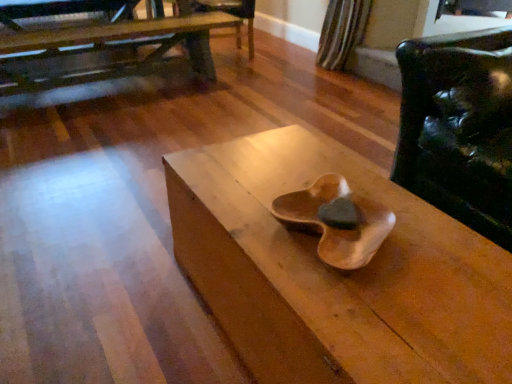
Question: Is wooden table at center, which ranks as the 2th table in back-to-front order, oriented away from wooden table at upper left, positioned as the second table in front-to-back order?

Choices:
 (A) yes
 (B) no

Answer: (B)

Question: Is wooden table at center, which is the 1th table from front to back, facing towards wooden table at upper left, positioned as the second table in front-to-back order?

Choices:
 (A) yes
 (B) no

Answer: (B)

Question: Does wooden table at center, which ranks as the 2th table in back-to-front order, lie behind wooden table at upper left, which ranks as the first table in top-to-bottom order?

Choices:
 (A) no
 (B) yes

Answer: (A)

Question: Is wooden table at center, positioned as the 2th table in left-to-right order, thinner than wooden table at upper left, arranged as the 1th table when viewed from the left?

Choices:
 (A) no
 (B) yes

Answer: (B)

Question: Can you confirm if wooden table at center, positioned as the 2th table in left-to-right order, is positioned to the right of wooden table at upper left, which ranks as the first table in top-to-bottom order?

Choices:
 (A) no
 (B) yes

Answer: (B)

Question: In the image, is wooden table at center, which is the 1th table from front to back, on the left side or the right side of wooden armchair at center?

Choices:
 (A) right
 (B) left

Answer: (A)

Question: In the image, is wooden table at center, which ranks as the 2th table in back-to-front order, positioned in front of or behind wooden armchair at center?

Choices:
 (A) behind
 (B) front

Answer: (B)

Question: From the image's perspective, is wooden table at center, positioned as the 2th table in left-to-right order, positioned above or below wooden armchair at center?

Choices:
 (A) below
 (B) above

Answer: (A)

Question: From a real-world perspective, is wooden table at center, marked as the 2th table in a top-to-bottom arrangement, physically located above or below wooden armchair at center?

Choices:
 (A) above
 (B) below

Answer: (B)

Question: In terms of size, does wooden table at center, which is the 1th table from front to back, appear bigger or smaller than glossy leather chair at right?

Choices:
 (A) small
 (B) big

Answer: (A)

Question: In terms of height, does wooden table at center, which ranks as the 2th table in back-to-front order, look taller or shorter compared to glossy leather chair at right?

Choices:
 (A) tall
 (B) short

Answer: (B)

Question: Is point (211, 254) closer or farther from the camera than point (492, 109)?

Choices:
 (A) farther
 (B) closer

Answer: (B)

Question: From the image's perspective, relative to glossy leather chair at right, is wooden table at center, positioned as the first table in bottom-to-top order, above or below?

Choices:
 (A) above
 (B) below

Answer: (B)

Question: Considering the relative positions of wooden armchair at center and wooden table at upper left, positioned as the 2th table in bottom-to-top order, in the image provided, is wooden armchair at center to the left or to the right of wooden table at upper left, positioned as the 2th table in bottom-to-top order,?

Choices:
 (A) right
 (B) left

Answer: (A)

Question: Considering the positions of wooden armchair at center and wooden table at upper left, the 2th table positioned from the right, in the image, is wooden armchair at center wider or thinner than wooden table at upper left, the 2th table positioned from the right,?

Choices:
 (A) wide
 (B) thin

Answer: (B)